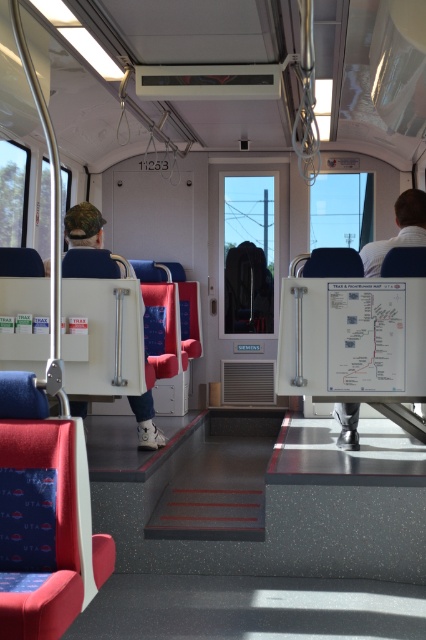
You are a passenger on this light rail train and you see a white fabric shirt at right and a matte white cap at left. Which object is positioned higher in the scene?

The white fabric shirt at right is located above the matte white cap at left, so the white fabric shirt at right is positioned higher in the scene.

From the picture: You are a passenger on this light rail train and you see a white fabric shirt at right and a matte white cap at left. Which object takes up more space in the scene?

The white fabric shirt at right is larger in size than the matte white cap at left, so it takes up more space in the scene.

You are a passenger on the light rail train and see the point marked at coordinates (399, 230). What object does this point correspond to?

The point at coordinates (399, 230) corresponds to the white fabric shirt at right.